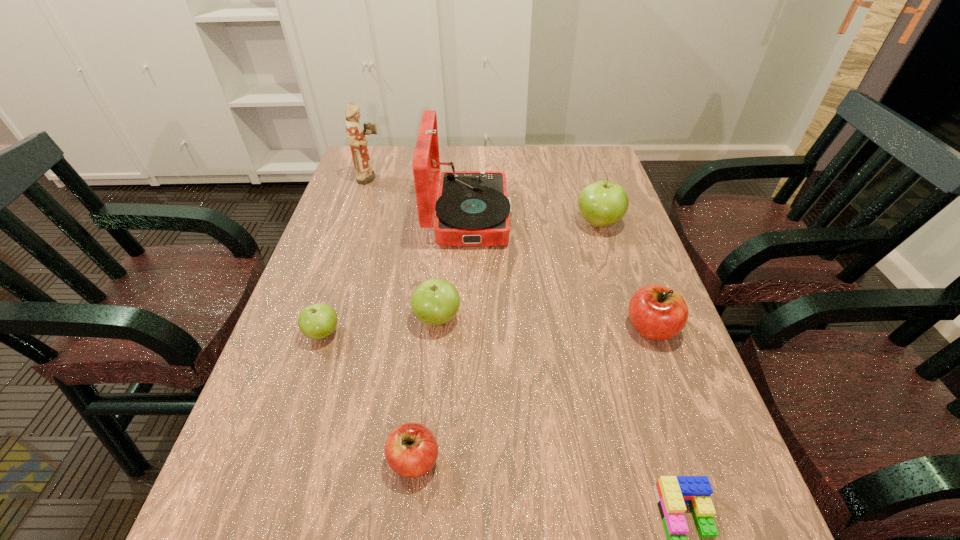
Identify the location of free space that is in between the leftmost green apple and the farther red apple. (487, 330).

What are the coordinates of `free space between the second smallest green apple and the leftmost apple` in the screenshot? It's located at (380, 326).

What are the coordinates of `vacant area between the farthest object and the nearest apple` in the screenshot? It's located at (393, 320).

Select which object is the closest to the phonograph_record. Please provide its 2D coordinates. Your answer should be formatted as a tuple, i.e. [(x, y)], where the tuple contains the x and y coordinates of a point satisfying the conditions above.

[(356, 136)]

Locate an element on the screen. This screenshot has height=540, width=960. object that is the second closest to the second biggest green apple is located at coordinates (473, 208).

Identify which apple is located as the third nearest to the bigger red apple. Please provide its 2D coordinates. Your answer should be formatted as a tuple, i.e. [(x, y)], where the tuple contains the x and y coordinates of a point satisfying the conditions above.

[(411, 450)]

Choose which apple is the nearest neighbor to the biggest green apple. Please provide its 2D coordinates. Your answer should be formatted as a tuple, i.e. [(x, y)], where the tuple contains the x and y coordinates of a point satisfying the conditions above.

[(656, 312)]

Identify which green apple is the second nearest to the farther red apple. Please provide its 2D coordinates. Your answer should be formatted as a tuple, i.e. [(x, y)], where the tuple contains the x and y coordinates of a point satisfying the conditions above.

[(434, 302)]

At what (x,y) coordinates should I click in order to perform the action: click on green apple identified as the second closest to the biggest green apple. Please return your answer as a coordinate pair (x, y). This screenshot has height=540, width=960. Looking at the image, I should click on (317, 321).

Where is `free location that satisfies the following two spatial constraints: 1. on the front side of the sixth shortest object; 2. on the left side of the right red apple`? This screenshot has height=540, width=960. free location that satisfies the following two spatial constraints: 1. on the front side of the sixth shortest object; 2. on the left side of the right red apple is located at coordinates (632, 328).